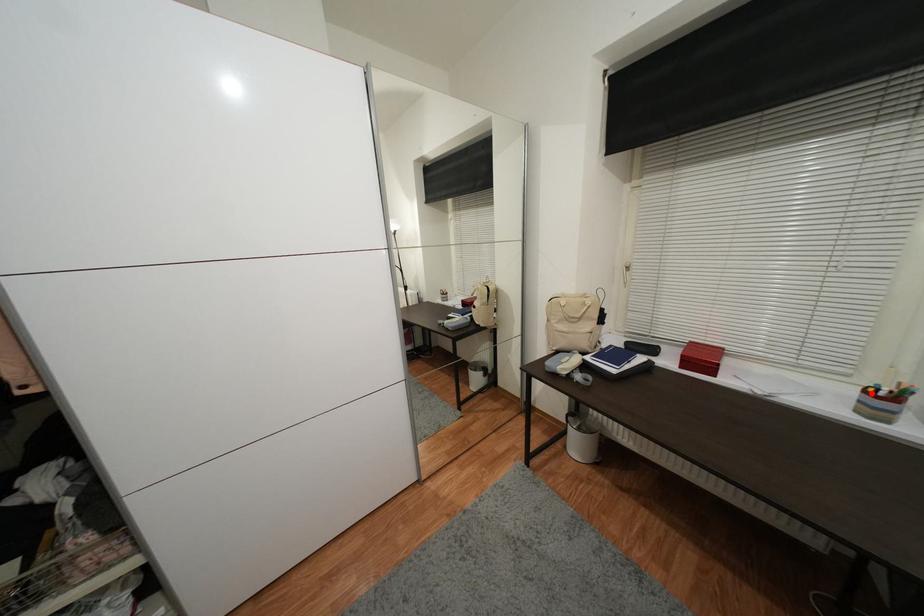
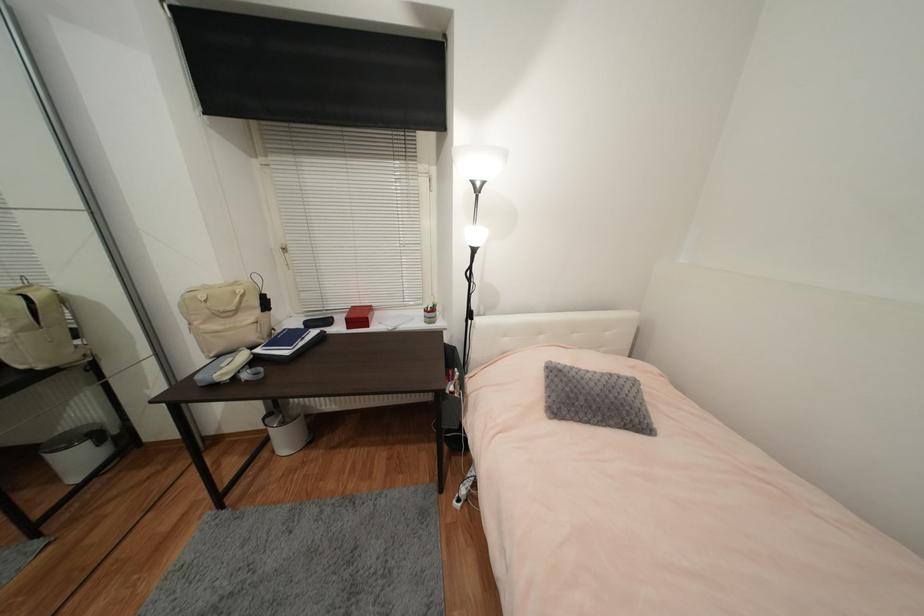
In the second image, find the point that corresponds to the highlighted location in the first image.

(430, 312)